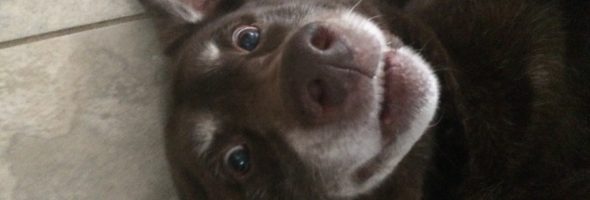
Identify the location of the chest. (241, 16).